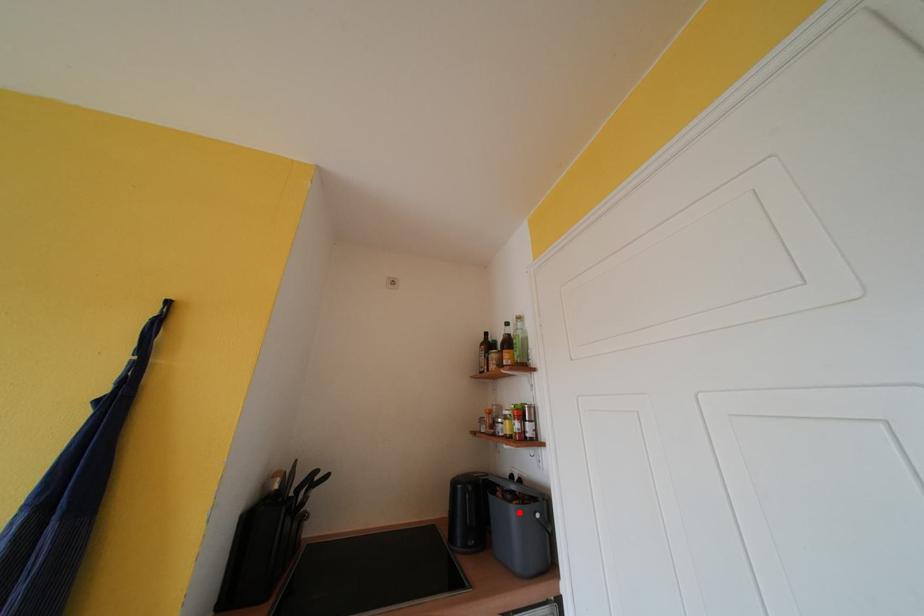
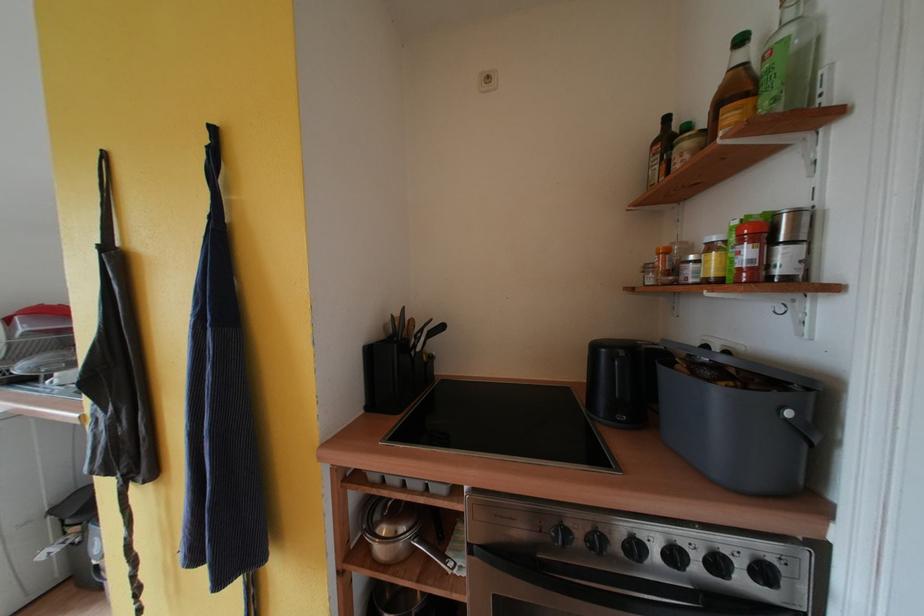
Locate, in the second image, the point that corresponds to the highlighted location in the first image.

(723, 397)